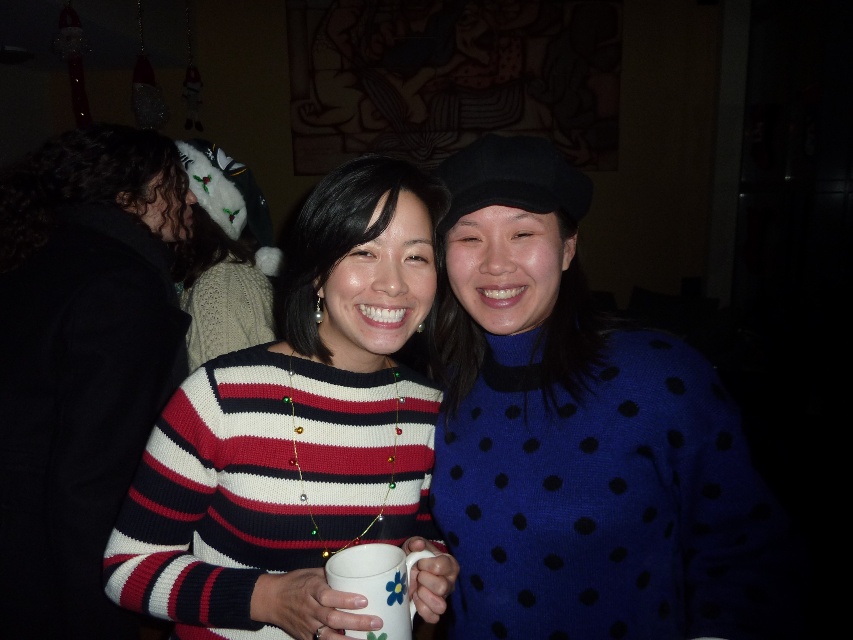
You are taking a photo of the blue dotted sweater at center and the white knitted sweater at upper left. Which one should you focus on first if you want to capture both clearly in the same frame?

You should focus on the blue dotted sweater at center first because it is closer to the viewer than the white knitted sweater at upper left, ensuring both will be in focus when using a shallow depth of field.

You are trying to decide which sweater to wear today. You see the striped knit sweater at center and the white knitted sweater at upper left in the image. Which one is positioned to the left side of the other?

The striped knit sweater at center is to the left of the white knitted sweater at upper left.